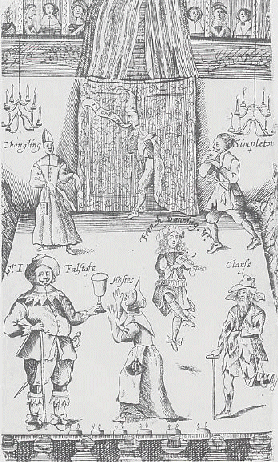
The height and width of the screenshot is (462, 278). Find the location of `candles`. candles is located at coordinates click(26, 91), click(5, 99), click(38, 111), click(33, 100), click(236, 105), click(268, 104), click(240, 122).